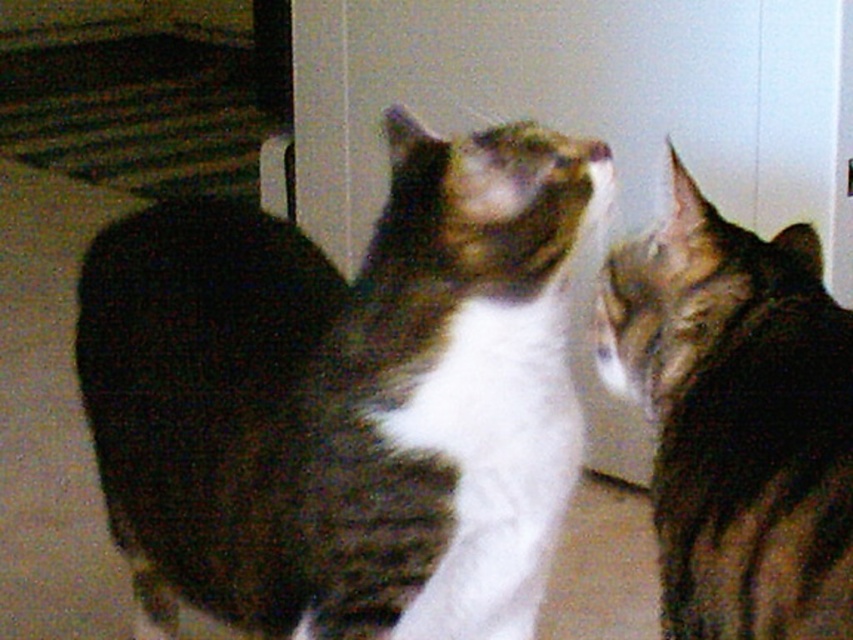
You are a photographer who wants to take a closeup shot of the white fur cat at center. Based on the coordinates provided, where should you position your camera relative to the image frame?

The white fur cat at center is located at coordinates point (345, 397), so you should position your camera slightly to the right and middle of the image frame to capture it in focus.

You are a photographer trying to capture both cats in a single frame. Since the white fur cat at center is larger than the tabby fur cat at right, which cat should you adjust your camera focus on to ensure both are in focus?

The white fur cat at center is larger in size than the tabby fur cat at right, so you should focus on the white fur cat at center to ensure both are in focus as it takes up more space in the frame.

You are a photographer setting up a camera at eye level with the white fur cat at center and the tabby fur cat at right. Which cat will appear larger in the photo?

The white fur cat at center will appear larger in the photo because it is much taller than the tabby fur cat at right.